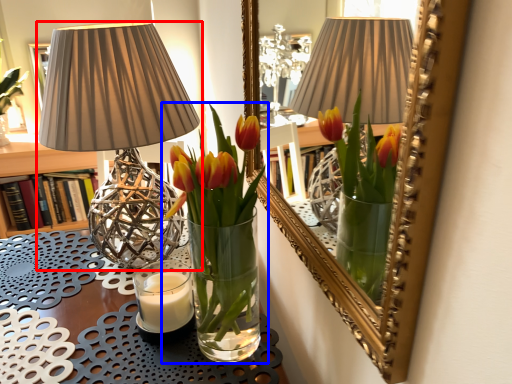
Question: Among these objects, which one is nearest to the camera, lamp (highlighted by a red box) or houseplant (highlighted by a blue box)?

Choices:
 (A) lamp
 (B) houseplant

Answer: (B)